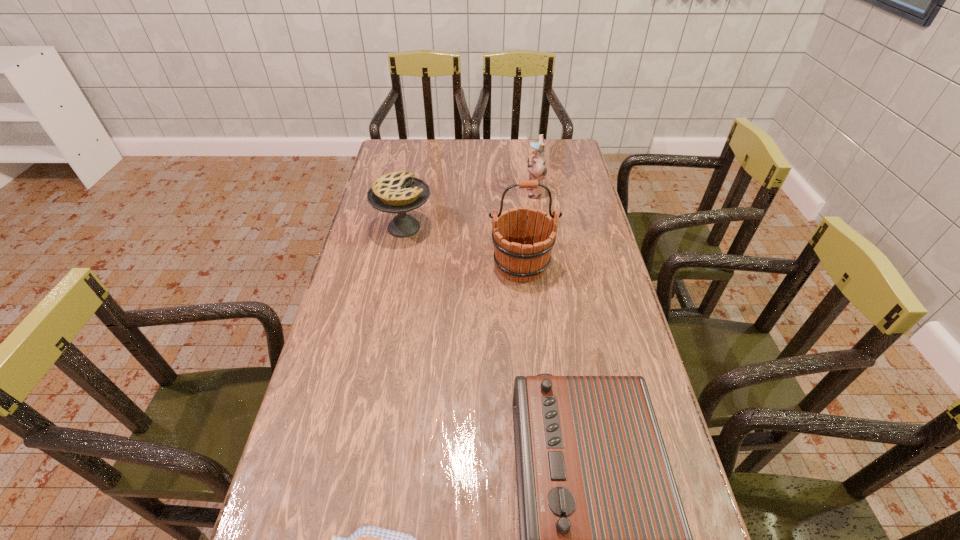
Where is `vacant space at the far edge`? vacant space at the far edge is located at coordinates (450, 148).

This screenshot has width=960, height=540. Identify the location of vacant space at the left edge of the desktop. (339, 336).

This screenshot has height=540, width=960. What are the coordinates of `vacant space at the right edge` in the screenshot? It's located at point(596,292).

Locate an element on the screen. The height and width of the screenshot is (540, 960). blank space at the far right corner of the desktop is located at coordinates (565, 143).

Identify the location of free spot between the taller pie and the figurine. Image resolution: width=960 pixels, height=540 pixels. (468, 210).

Locate which object is the second closest to the nearer pie. Please provide its 2D coordinates. Your answer should be formatted as a tuple, i.e. [(x, y)], where the tuple contains the x and y coordinates of a point satisfying the conditions above.

[(521, 258)]

Locate an element on the screen. object that is the fourth nearest to the tallest object is located at coordinates (368, 539).

Where is `free point that satisfies the following two spatial constraints: 1. on the back side of the wine bucket; 2. on the cut side of the farther pie`? The width and height of the screenshot is (960, 540). free point that satisfies the following two spatial constraints: 1. on the back side of the wine bucket; 2. on the cut side of the farther pie is located at coordinates (517, 227).